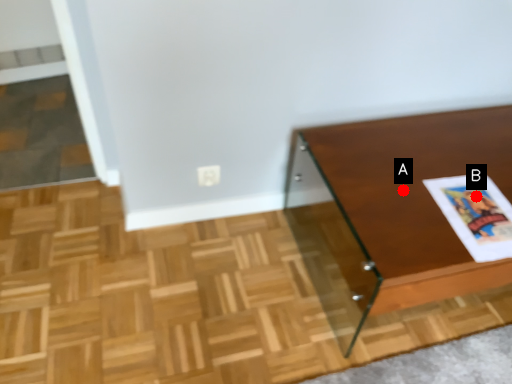
Question: Two points are circled on the image, labeled by A and B beside each circle. Which point is farther from the camera taking this photo?

Choices:
 (A) A is further
 (B) B is further

Answer: (B)